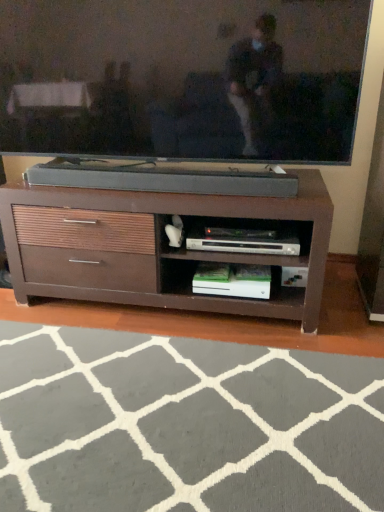
Question: From a real-world perspective, relative to brown wood chest of drawers at center, is matte black tv at upper center vertically above or below?

Choices:
 (A) below
 (B) above

Answer: (B)

Question: In the image, is matte black tv at upper center on the left side or the right side of brown wood chest of drawers at center?

Choices:
 (A) left
 (B) right

Answer: (A)

Question: Estimate the real-world distances between objects in this image. Which object is closer to the gray soft rug at lower center?

Choices:
 (A) brown wood chest of drawers at center
 (B) matte black tv at upper center

Answer: (A)

Question: Which object is the closest to the gray soft rug at lower center?

Choices:
 (A) matte black tv at upper center
 (B) brown wood chest of drawers at center

Answer: (B)